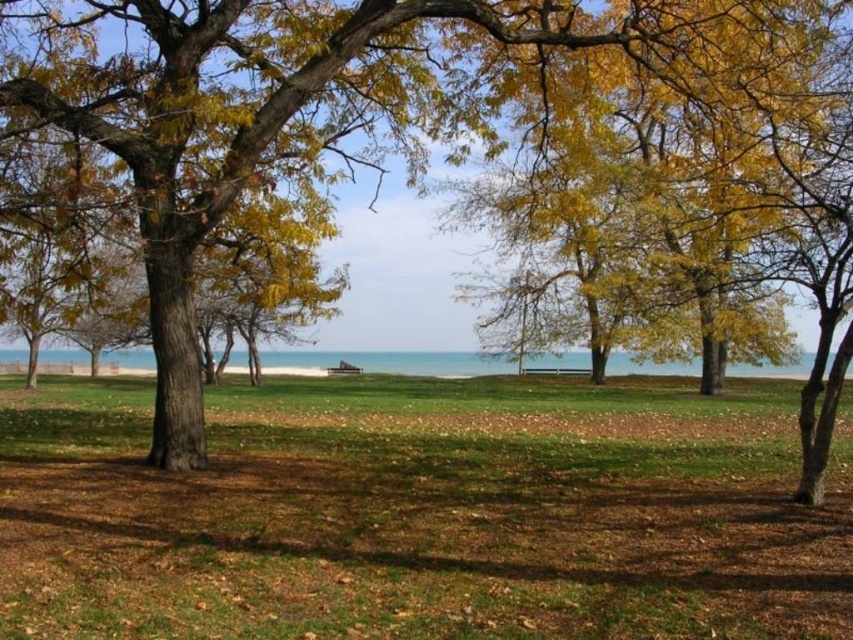
Question: Which object is farther from the camera taking this photo?

Choices:
 (A) blue water at center
 (B) yellow leafy tree at center

Answer: (B)

Question: Can you confirm if yellow leafy tree at center is wider than blue water at center?

Choices:
 (A) no
 (B) yes

Answer: (A)

Question: Which point is closer to the camera?

Choices:
 (A) (434, 74)
 (B) (381, 358)

Answer: (A)

Question: Which point is closer to the camera?

Choices:
 (A) (187, 442)
 (B) (775, 368)

Answer: (A)

Question: Does yellow leafy tree at center appear on the right side of blue water at center?

Choices:
 (A) yes
 (B) no

Answer: (A)

Question: Is yellow leafy tree at center closer to camera compared to blue water at center?

Choices:
 (A) yes
 (B) no

Answer: (B)